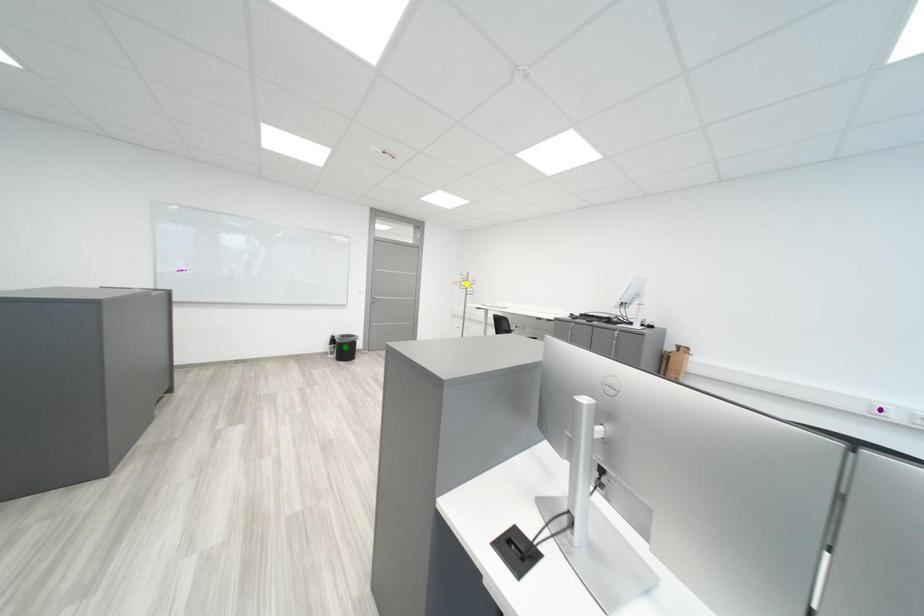
Order these from nearest to farthest:
yellow point, green point, purple point

purple point, green point, yellow point